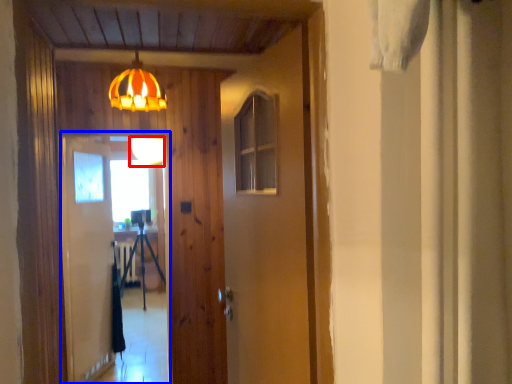
Question: Which point is closer to the camera, lamp (highlighted by a red box) or screen door (highlighted by a blue box)?

Choices:
 (A) lamp
 (B) screen door

Answer: (B)